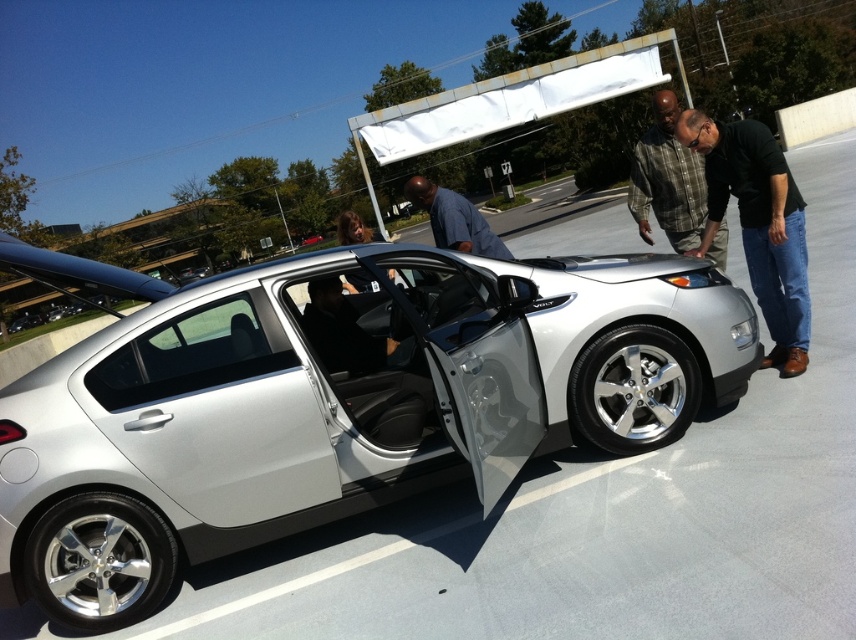
You are a photographer trying to capture a photo of the silver metallic sedan at center and the plaid shirt at center. If you want both subjects to be clearly visible in the frame, which one should you focus on first?

The silver metallic sedan at center is larger in size than plaid shirt at center, so you should focus on the silver metallic sedan at center first to ensure it is in sharp focus before adjusting for the smaller plaid shirt at center.

You are a photographer trying to capture a photo of the silver metallic sedan at center and the plaid shirt at center. Since you want both subjects to be in focus, you need to adjust your camera settings. Which subject should you focus on to ensure both are sharp?

The silver metallic sedan at center is much taller than the plaid shirt at center, so focusing on the sedan will help keep both in focus as it is farther away.